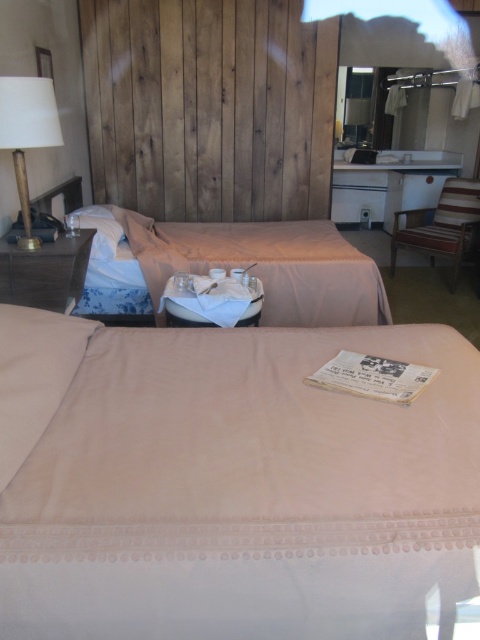
Question: Which object is farther from the camera taking this photo?

Choices:
 (A) beige fabric bed at center
 (B) matte gold lamp at upper left
 (C) beige fabric pillow at lower left
 (D) pink fabric bed at lower center

Answer: (A)

Question: Is beige fabric bed at center to the left of beige fabric pillow at lower left from the viewer's perspective?

Choices:
 (A) yes
 (B) no

Answer: (B)

Question: Is beige fabric pillow at lower left in front of matte gold lamp at upper left?

Choices:
 (A) no
 (B) yes

Answer: (B)

Question: Which point is closer to the camera?

Choices:
 (A) beige fabric pillow at lower left
 (B) pink fabric bed at lower center

Answer: (B)

Question: Which point is closer to the camera?

Choices:
 (A) (375, 317)
 (B) (33, 346)

Answer: (B)

Question: Does pink fabric bed at lower center appear under beige fabric pillow at lower left?

Choices:
 (A) yes
 (B) no

Answer: (A)